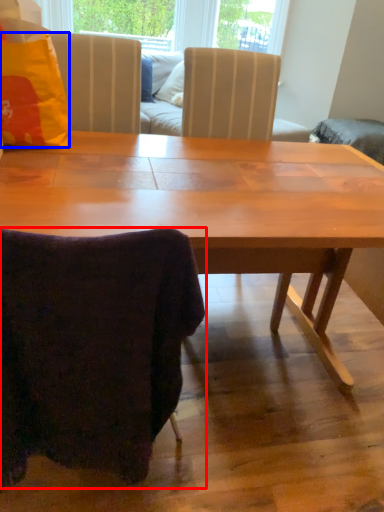
Question: Which of the following is the closest to the observer, chair (highlighted by a red box) or pillow (highlighted by a blue box)?

Choices:
 (A) chair
 (B) pillow

Answer: (A)